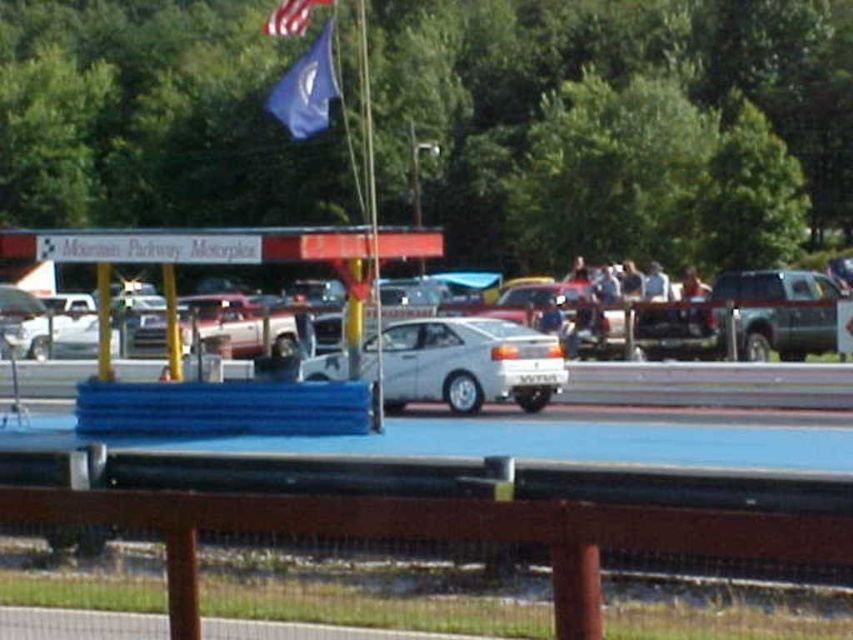
You are a photographer standing at the starting line of the race track. You want to take a photo that includes both the metallic flag pole at center and the american flag at upper center. Considering their positions, can you fit both in your camera frame without moving your position?

The metallic flag pole at center is 6.35 meters away from the american flag at upper center. Since the distance between them is relatively close, you can likely fit both in your camera frame without moving your position.

You are a photographer standing at the edge of the race track. You need to capture a photo of the white matte sedan at center and the american flag at upper center. Which object is closer to the camera?

The white matte sedan at center is closer to the camera than the american flag at upper center because it is shorter in height compared to the flagpole.

You are a photographer setting up for a car event. You need to place a 2m wide equipment setup between the metallic silver suv at right and the metallic flag pole at center. Can you fit it without overlapping either object?

The metallic silver suv at right is wider than the metallic flag pole at center. However, without knowing the exact distance between them, it is impossible to determine if the 2m wide equipment setup can fit between them.